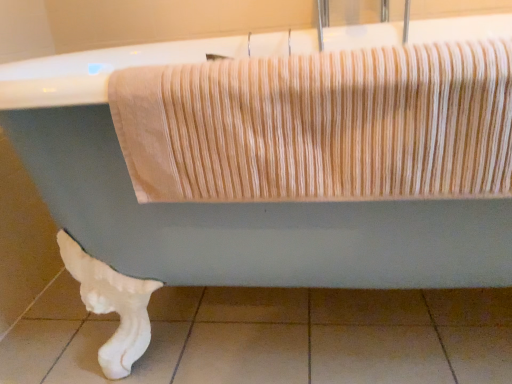
What do you see at coordinates (321, 125) in the screenshot? I see `beige striped towel at upper center` at bounding box center [321, 125].

This screenshot has height=384, width=512. What are the coordinates of `beige striped towel at upper center` in the screenshot? It's located at 321,125.

Image resolution: width=512 pixels, height=384 pixels. I want to click on beige striped towel at upper center, so click(x=321, y=125).